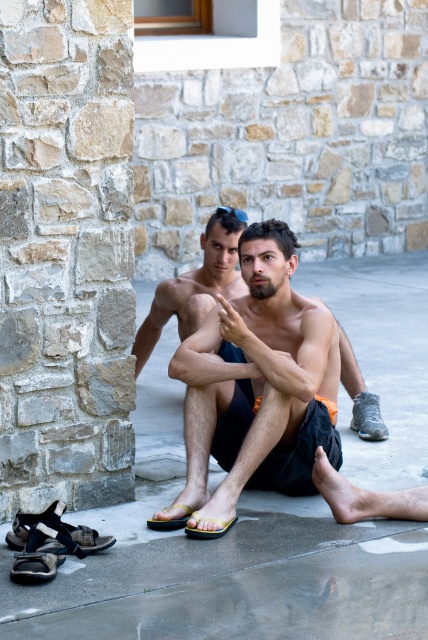
Question: Which object is farther from the camera taking this photo?

Choices:
 (A) smooth skin man at center
 (B) white mesh sneaker at lower right
 (C) yellow fabric sandal at lower center
 (D) brown leather sandal at lower left

Answer: (B)

Question: Does smooth skin man at center appear over black leather sandal at lower left?

Choices:
 (A) yes
 (B) no

Answer: (A)

Question: Among these objects, which one is farthest from the camera?

Choices:
 (A) white mesh sneaker at lower right
 (B) natural stone pillar at left
 (C) yellow fabric sandal at lower center

Answer: (A)

Question: In this image, where is natural stone pillar at left located relative to black leather sandal at lower left?

Choices:
 (A) below
 (B) above

Answer: (B)

Question: Estimate the real-world distances between objects in this image. Which object is closer to the black leather sandal at lower left?

Choices:
 (A) yellow matte sandal at lower center
 (B) brown leather sandal at lower left

Answer: (B)

Question: Does black leather sandal at lower left appear on the left side of white mesh sneaker at lower right?

Choices:
 (A) yes
 (B) no

Answer: (A)